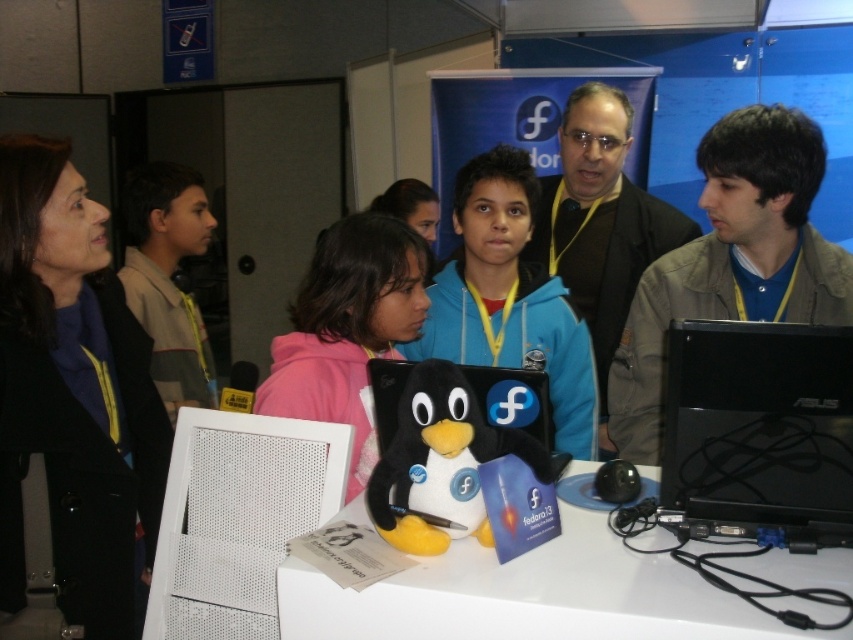
Which is below, light brown jacket at center or brown uniform shirt at left?

light brown jacket at center

Who is more distant from viewer, (715,282) or (171,384)?

The point (171,384) is more distant.

This screenshot has width=853, height=640. I want to click on light brown jacket at center, so click(732, 260).

Which is below, black plush penguin at center or brown uniform shirt at left?

black plush penguin at center is lower down.

Identify the location of black plush penguin at center. The width and height of the screenshot is (853, 640). (442, 464).

Does matte black jacket at left have a greater height compared to brown uniform shirt at left?

Correct, matte black jacket at left is much taller as brown uniform shirt at left.

This screenshot has height=640, width=853. I want to click on matte black jacket at left, so click(74, 390).

Where is `matte black jacket at left`? Image resolution: width=853 pixels, height=640 pixels. matte black jacket at left is located at coordinates (74, 390).